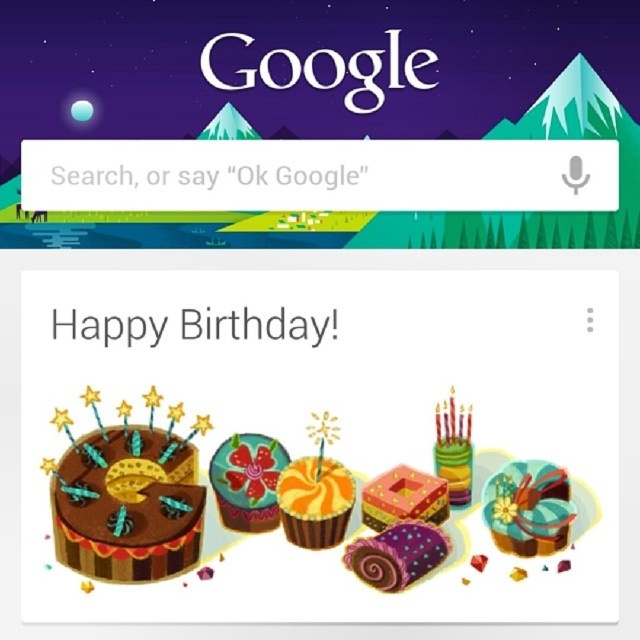
Question: Does chocolate matte cake at center appear under swirled orange cupcake at center?

Choices:
 (A) no
 (B) yes

Answer: (A)

Question: Which point is closer to the camera?

Choices:
 (A) shiny blue frosting cake at center
 (B) shiny metallic cake at center right
 (C) black paper text at center
 (D) matte pink cake at center

Answer: (B)

Question: Does chocolate matte cake at center have a larger size compared to black paper text at center?

Choices:
 (A) yes
 (B) no

Answer: (A)

Question: Based on their relative distances, which object is farther from the purple glossy cake at center?

Choices:
 (A) swirled orange cupcake at center
 (B) colorful paper cake at center

Answer: (B)

Question: Which of these objects is positioned farthest from the black paper text at center?

Choices:
 (A) colorful paper cake at center
 (B) swirled orange cupcake at center

Answer: (B)

Question: Does black paper text at center have a greater width compared to purple glossy cake at center?

Choices:
 (A) no
 (B) yes

Answer: (B)